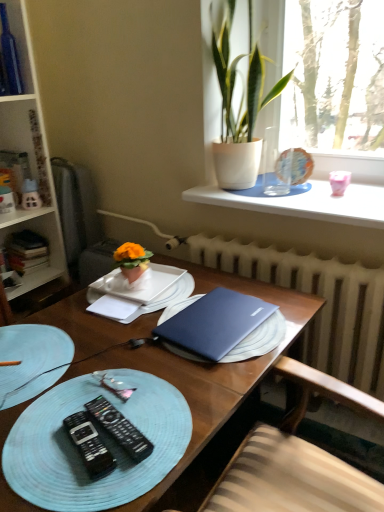
Where is `vacant area in front of pink glossy coffee cup at upper right`? The image size is (384, 512). vacant area in front of pink glossy coffee cup at upper right is located at coordinates (342, 208).